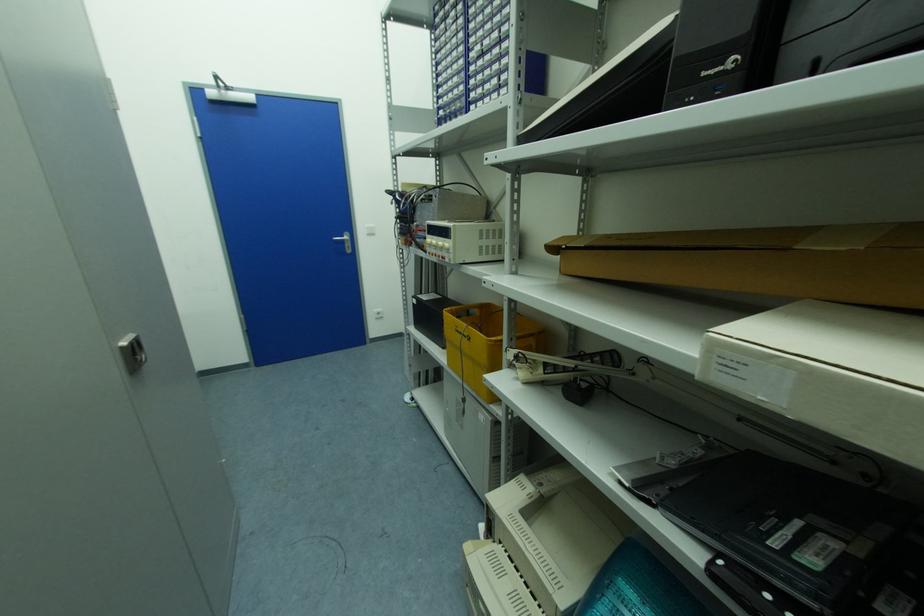
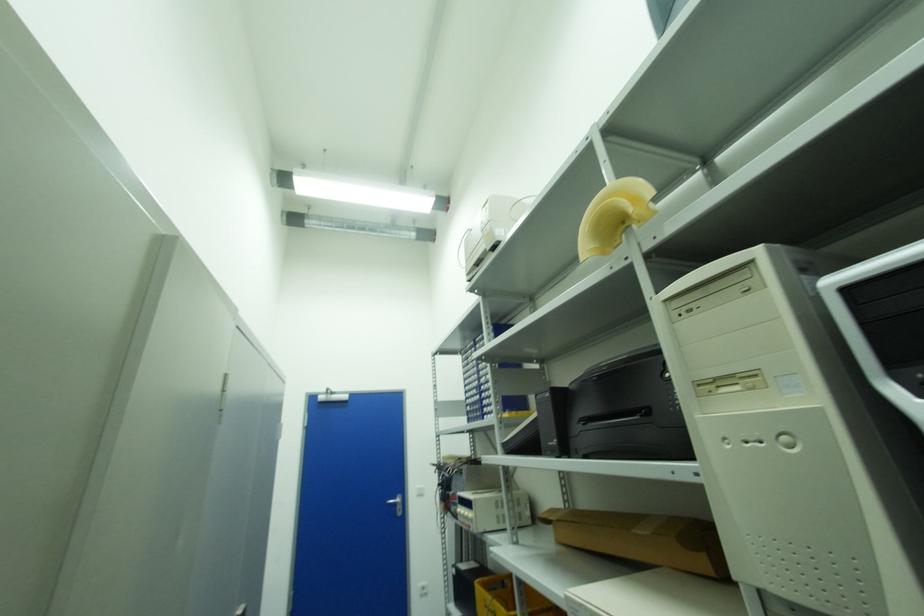
Question: Based on the continuous images, in which direction is the camera rotating? Reply with the corresponding letter.

Choices:
 (A) Left
 (B) Right
 (C) Up
 (D) Down

Answer: (C)